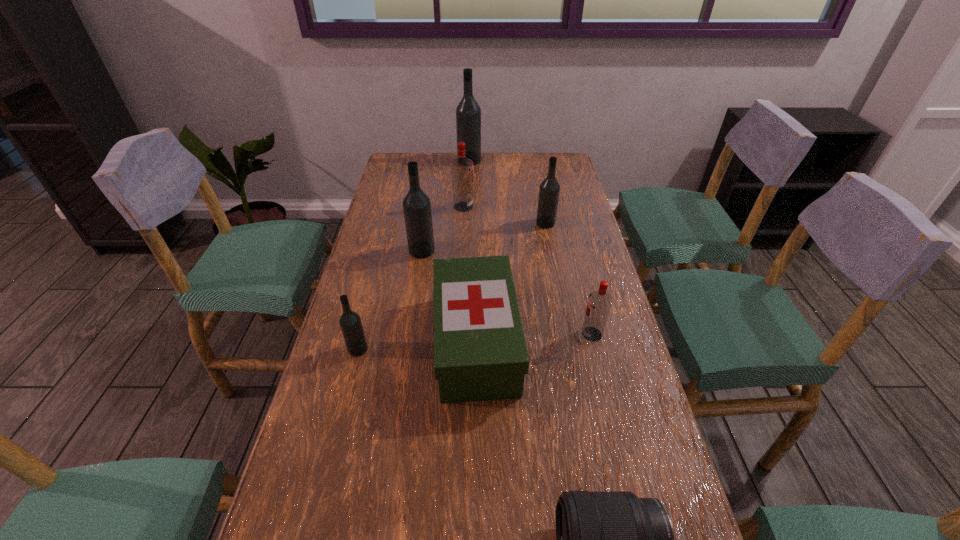
Identify the location of the farthest vodka. (468, 113).

Identify the location of the tallest vodka. This screenshot has width=960, height=540. (468, 113).

You are a GUI agent. You are given a task and a screenshot of the screen. Output one action in this format:
    pyautogui.click(x=<x>, y=<y>)
    Task: Click on the fourth farthest vodka
    Image resolution: width=960 pixels, height=540 pixels.
    Given the screenshot: What is the action you would take?
    pyautogui.click(x=416, y=205)

I want to click on the fifth nearest object, so click(416, 205).

Locate an element on the screen. the seventh nearest object is located at coordinates (461, 167).

Where is `the farther red vodka`? The width and height of the screenshot is (960, 540). the farther red vodka is located at coordinates (461, 167).

Identify the location of the fourth nearest vodka. (549, 190).

At what (x,y) coordinates should I click in order to perform the action: click on the rightmost black vodka. Please return your answer as a coordinate pair (x, y). The image size is (960, 540). Looking at the image, I should click on (549, 190).

At what (x,y) coordinates should I click in order to perform the action: click on the smaller red vodka. Please return your answer as a coordinate pair (x, y). The height and width of the screenshot is (540, 960). Looking at the image, I should click on (599, 303).

Locate an element on the screen. The image size is (960, 540). the rightmost vodka is located at coordinates (599, 303).